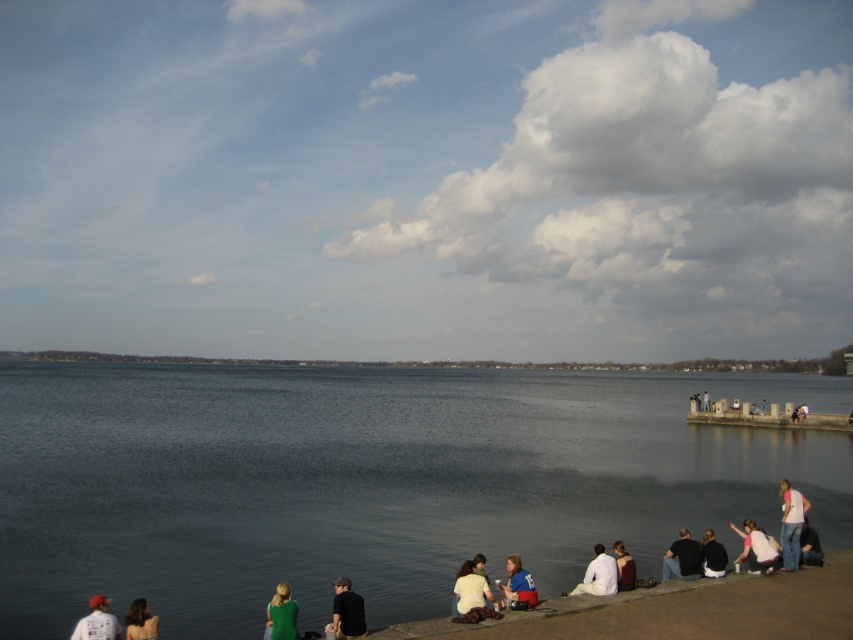
Can you confirm if white matte shirt at lower right is shorter than green fabric shirt at lower left?

Incorrect, white matte shirt at lower right's height does not fall short of green fabric shirt at lower left's.

Is white matte shirt at lower right behind green fabric shirt at lower left?

Yes, white matte shirt at lower right is behind green fabric shirt at lower left.

Does point (766, 552) come in front of point (146, 618)?

No, (766, 552) is behind (146, 618).

Where is `white matte shirt at lower right`? The height and width of the screenshot is (640, 853). white matte shirt at lower right is located at coordinates (755, 548).

Can you confirm if green matte dress at lower center is positioned to the right of green fabric shirt at lower left?

Yes, green matte dress at lower center is to the right of green fabric shirt at lower left.

Identify the location of green matte dress at lower center. The width and height of the screenshot is (853, 640). (282, 612).

Who is shorter, white matte shirt at lower right or light brown leather jacket at lower center?

With less height is light brown leather jacket at lower center.

Which is behind, point (764, 566) or point (483, 586)?

Positioned behind is point (764, 566).

Find the location of a particular element. white matte shirt at lower right is located at coordinates (755, 548).